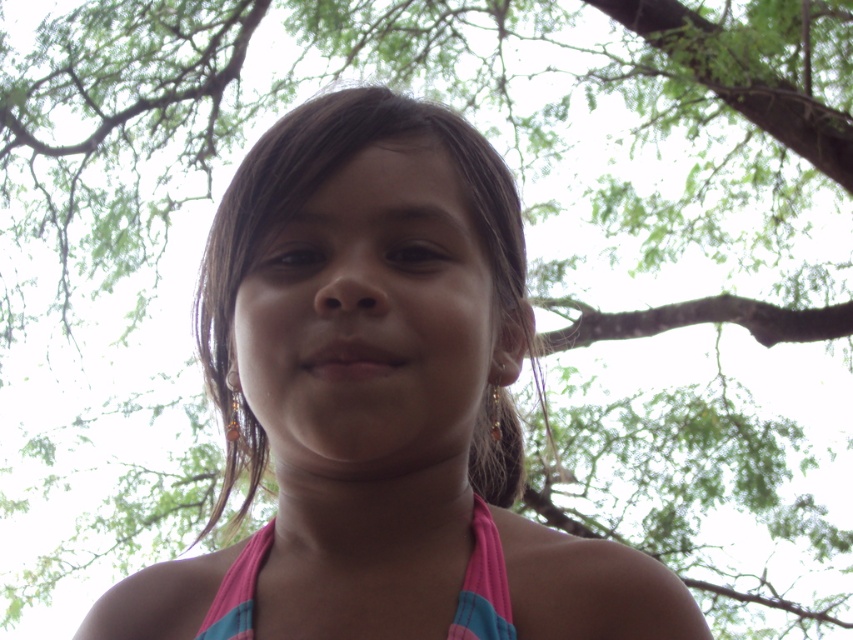
Question: Which point appears farthest from the camera in this image?

Choices:
 (A) pos(276,340)
 (B) pos(244,621)

Answer: (B)

Question: Is pink fabric at center to the right of pink fabric bikini top at center from the viewer's perspective?

Choices:
 (A) no
 (B) yes

Answer: (B)

Question: Which point is closer to the camera?

Choices:
 (A) (490, 480)
 (B) (486, 513)

Answer: (B)

Question: Is pink fabric at center to the right of pink fabric bikini top at center from the viewer's perspective?

Choices:
 (A) yes
 (B) no

Answer: (A)

Question: Which of the following is the farthest from the observer?

Choices:
 (A) pink fabric at center
 (B) pink fabric bikini top at center

Answer: (B)

Question: Is the position of pink fabric at center more distant than that of pink fabric bikini top at center?

Choices:
 (A) no
 (B) yes

Answer: (A)